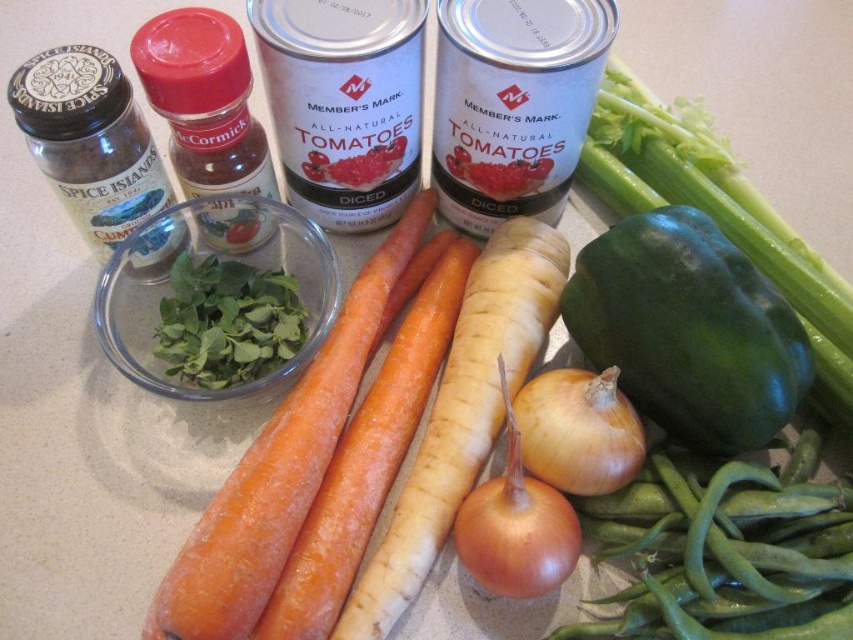
You are organizing vegetables on a countertop and see the brown matte onion at lower center and the yellow matte onion at center. Which onion is taller?

The brown matte onion at lower center is much taller than the yellow matte onion at center.

You are organizing vegetables on a countertop and see the green smooth celery at center right and the brown matte onion at lower center. Which vegetable is located to the right of the other?

The green smooth celery at center right is positioned on the right side of brown matte onion at lower center.

You are organizing vegetables on a shelf and need to place the brown matte onion at lower center and the yellow matte onion at center. Which onion should you place in a spot that requires less space due to its smaller size?

The brown matte onion at lower center has a lesser width compared to the yellow matte onion at center, so it should be placed in the spot that requires less space due to its smaller size.